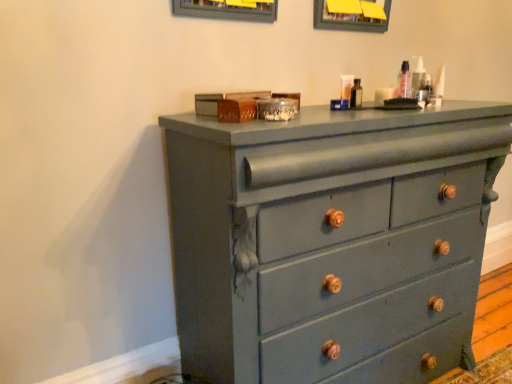
Question: Can you confirm if matte gray dresser at center is shorter than matte gray picture frame at upper center?

Choices:
 (A) no
 (B) yes

Answer: (A)

Question: Is matte gray dresser at center positioned far away from matte gray picture frame at upper center?

Choices:
 (A) no
 (B) yes

Answer: (A)

Question: Does matte gray dresser at center have a larger size compared to matte gray picture frame at upper center?

Choices:
 (A) yes
 (B) no

Answer: (A)

Question: Is matte gray dresser at center further to the viewer compared to matte gray picture frame at upper center?

Choices:
 (A) no
 (B) yes

Answer: (A)

Question: From a real-world perspective, is matte gray dresser at center located higher than matte gray picture frame at upper center?

Choices:
 (A) no
 (B) yes

Answer: (A)

Question: Is matte gray dresser at center facing towards matte gray picture frame at upper center?

Choices:
 (A) no
 (B) yes

Answer: (A)

Question: Is matte plastic container at upper right positioned beyond the bounds of matte gray dresser at center?

Choices:
 (A) no
 (B) yes

Answer: (B)

Question: Does matte plastic container at upper right have a greater height compared to matte gray dresser at center?

Choices:
 (A) no
 (B) yes

Answer: (A)

Question: Is matte plastic container at upper right oriented away from matte gray dresser at center?

Choices:
 (A) no
 (B) yes

Answer: (A)

Question: Is there a large distance between matte plastic container at upper right and matte gray dresser at center?

Choices:
 (A) no
 (B) yes

Answer: (A)

Question: Considering the relative sizes of matte plastic container at upper right and matte gray dresser at center in the image provided, is matte plastic container at upper right bigger than matte gray dresser at center?

Choices:
 (A) no
 (B) yes

Answer: (A)

Question: From a real-world perspective, is matte plastic container at upper right on top of matte gray dresser at center?

Choices:
 (A) no
 (B) yes

Answer: (B)

Question: Does matte gray dresser at center have a larger size compared to matte plastic container at upper right?

Choices:
 (A) no
 (B) yes

Answer: (B)